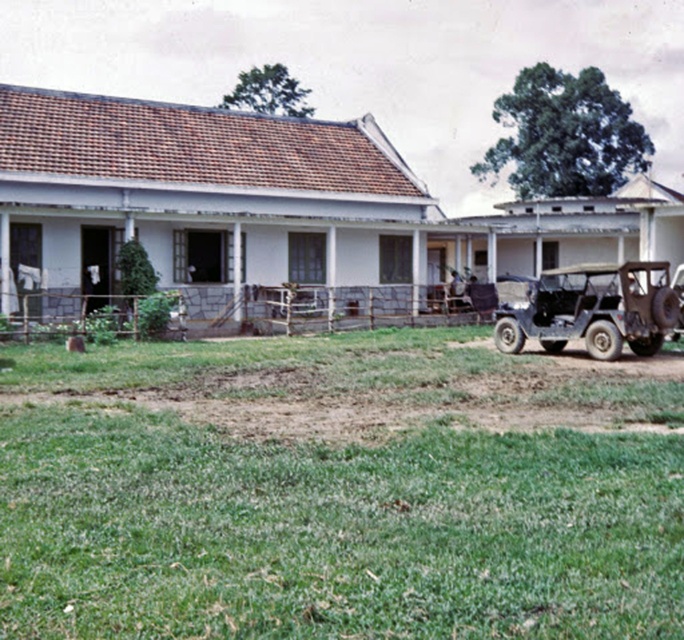
Can you confirm if green grass lawn at lower center is shorter than rusty metal jeep at right?

Incorrect, green grass lawn at lower center's height does not fall short of rusty metal jeep at right's.

Measure the distance between green grass lawn at lower center and camera.

13.40 feet

Who is more forward, (x=412, y=506) or (x=676, y=282)?

Point (x=412, y=506) is more forward.

This screenshot has height=640, width=684. Identify the location of green grass lawn at lower center. (339, 490).

Which of these two, green matte jeep at lower right or rusty metal jeep at right, stands shorter?

green matte jeep at lower right

Find the location of a particular element. green matte jeep at lower right is located at coordinates (592, 310).

This screenshot has height=640, width=684. What do you see at coordinates (592, 310) in the screenshot?
I see `green matte jeep at lower right` at bounding box center [592, 310].

Image resolution: width=684 pixels, height=640 pixels. I want to click on green matte jeep at lower right, so click(592, 310).

Which is more to the left, green grass lawn at lower center or green matte jeep at lower right?

green grass lawn at lower center

Does point (376, 540) come farther from viewer compared to point (538, 323)?

No, it is not.

Between point (386, 547) and point (648, 326), which one is positioned in front?

Positioned in front is point (386, 547).

This screenshot has height=640, width=684. In order to click on green grass lawn at lower center in this screenshot , I will do `click(339, 490)`.